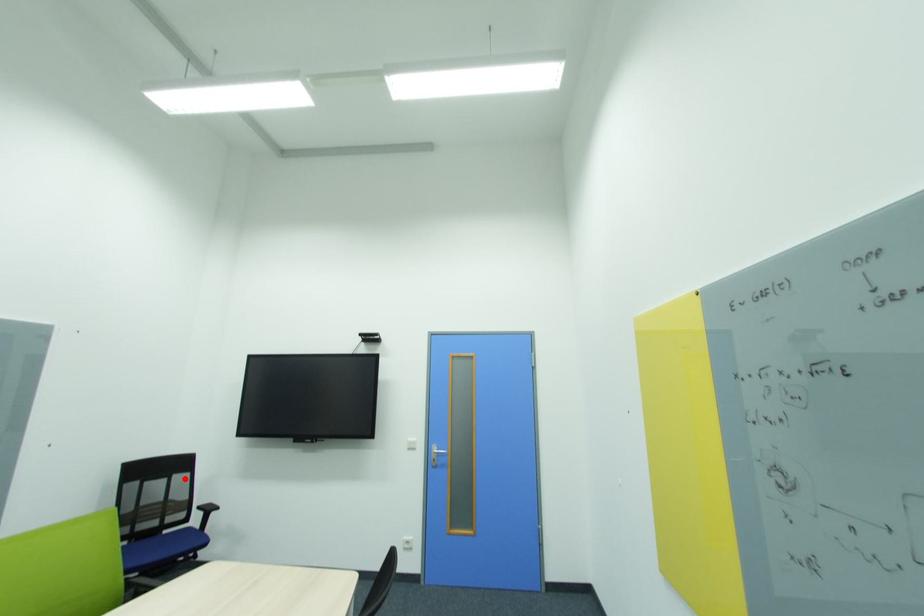
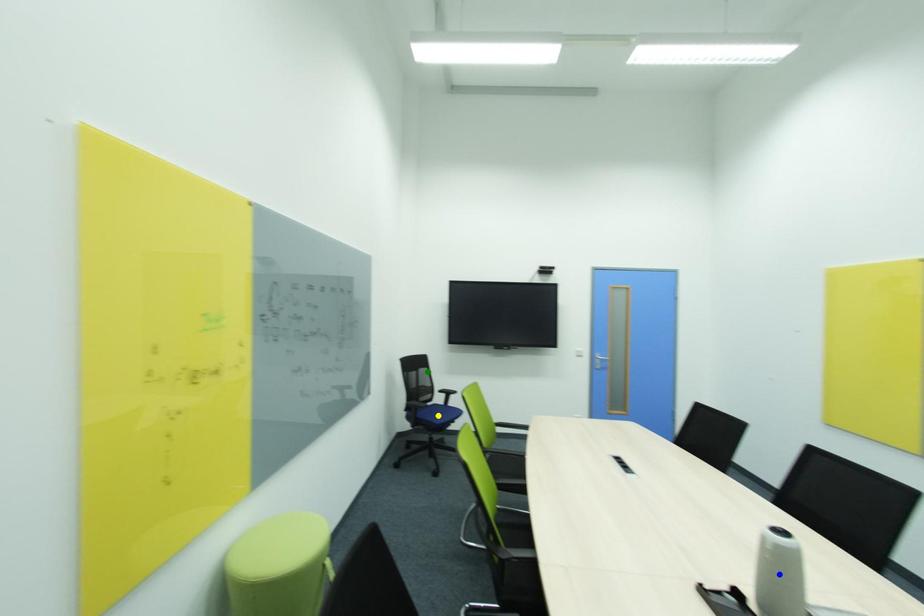
Question: I am providing you with two images of the same scene from different viewpoints. A red point is marked on the first image. You are given multiple points on the second image. Which spot in image 2 lines up with the point in image 1?

Choices:
 (A) yellow point
 (B) green point
 (C) blue point

Answer: (B)